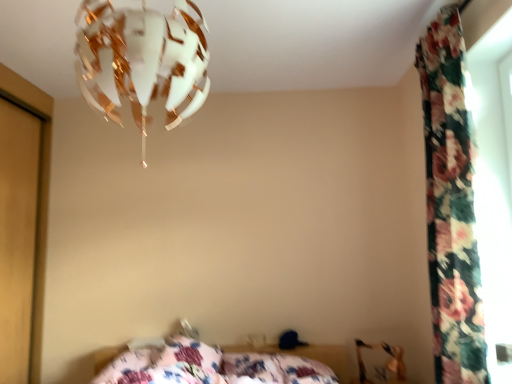
Question: From a real-world perspective, is floral fabric pillow at lower center, marked as the 1th pillow in a right-to-left arrangement, on top of floral fabric curtain at right?

Choices:
 (A) no
 (B) yes

Answer: (A)

Question: Is floral fabric pillow at lower center, the 2th pillow from the left, to the left of floral fabric curtain at right from the viewer's perspective?

Choices:
 (A) yes
 (B) no

Answer: (A)

Question: From the image's perspective, would you say floral fabric pillow at lower center, the 2th pillow from the left, is shown under floral fabric curtain at right?

Choices:
 (A) yes
 (B) no

Answer: (A)

Question: Is floral fabric pillow at lower center, marked as the 1th pillow in a right-to-left arrangement, bigger than floral fabric curtain at right?

Choices:
 (A) no
 (B) yes

Answer: (A)

Question: Is floral fabric pillow at lower center, the 2th pillow from the left, positioned before floral fabric curtain at right?

Choices:
 (A) yes
 (B) no

Answer: (B)

Question: Is floral fabric pillow at lower center, marked as the 1th pillow in a right-to-left arrangement, not close to floral fabric curtain at right?

Choices:
 (A) no
 (B) yes

Answer: (B)

Question: From the image's perspective, is white matte lampshade at upper center located above floral fabric pillow at lower center, marked as the 1th pillow in a right-to-left arrangement?

Choices:
 (A) yes
 (B) no

Answer: (A)

Question: Can you see white matte lampshade at upper center touching floral fabric pillow at lower center, marked as the 1th pillow in a right-to-left arrangement?

Choices:
 (A) yes
 (B) no

Answer: (B)

Question: Considering the relative positions of white matte lampshade at upper center and floral fabric pillow at lower center, the 2th pillow from the left, in the image provided, is white matte lampshade at upper center to the left of floral fabric pillow at lower center, the 2th pillow from the left, from the viewer's perspective?

Choices:
 (A) no
 (B) yes

Answer: (B)

Question: Considering the relative positions of white matte lampshade at upper center and floral fabric pillow at lower center, the 2th pillow from the left, in the image provided, is white matte lampshade at upper center to the right of floral fabric pillow at lower center, the 2th pillow from the left, from the viewer's perspective?

Choices:
 (A) yes
 (B) no

Answer: (B)

Question: From a real-world perspective, is white matte lampshade at upper center positioned under floral fabric pillow at lower center, marked as the 1th pillow in a right-to-left arrangement, based on gravity?

Choices:
 (A) no
 (B) yes

Answer: (A)

Question: Is white matte lampshade at upper center not within floral fabric pillow at lower center, marked as the 1th pillow in a right-to-left arrangement?

Choices:
 (A) no
 (B) yes

Answer: (B)

Question: Is metallic gold swivel chair at lower right positioned behind white matte lampshade at upper center?

Choices:
 (A) no
 (B) yes

Answer: (B)